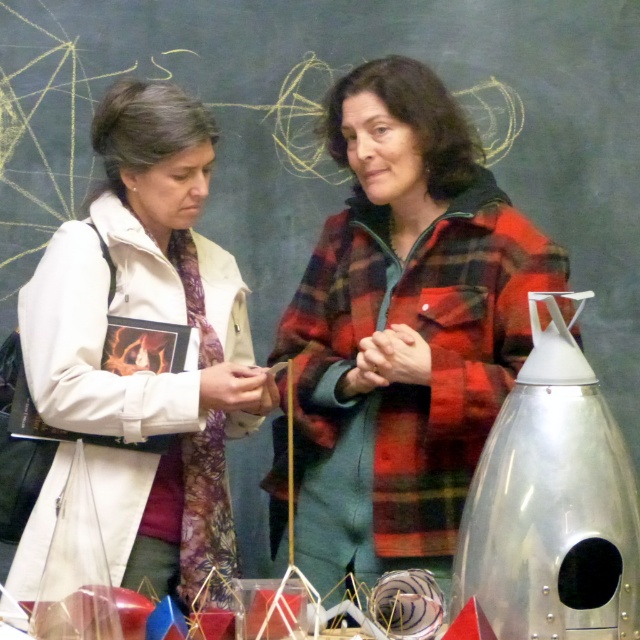
You are standing in the room where the two people are. You want to place a small plant exactly at point (403,330). What object will the plant be placed on top of?

The small plant placed at point (403,330) will be on top of the red plaid jacket at center.

From the picture: You are an observer standing in front of the two people. Which person is wearing the red plaid jacket at center located to the right side of the white matte jacket at center?

The red plaid jacket at center is to the right of the white matte jacket at center, so the person wearing the red plaid jacket at center is located to the right side of the white matte jacket at center.

What are the coordinates of the red plaid jacket at center?

The coordinates of the red plaid jacket at center are at point (403, 330).